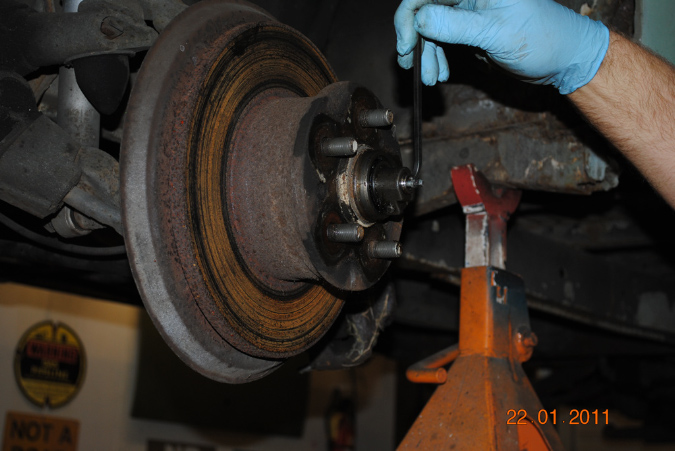
The width and height of the screenshot is (675, 451). I want to click on stickers, so click(x=53, y=370), click(x=47, y=438), click(x=182, y=443).